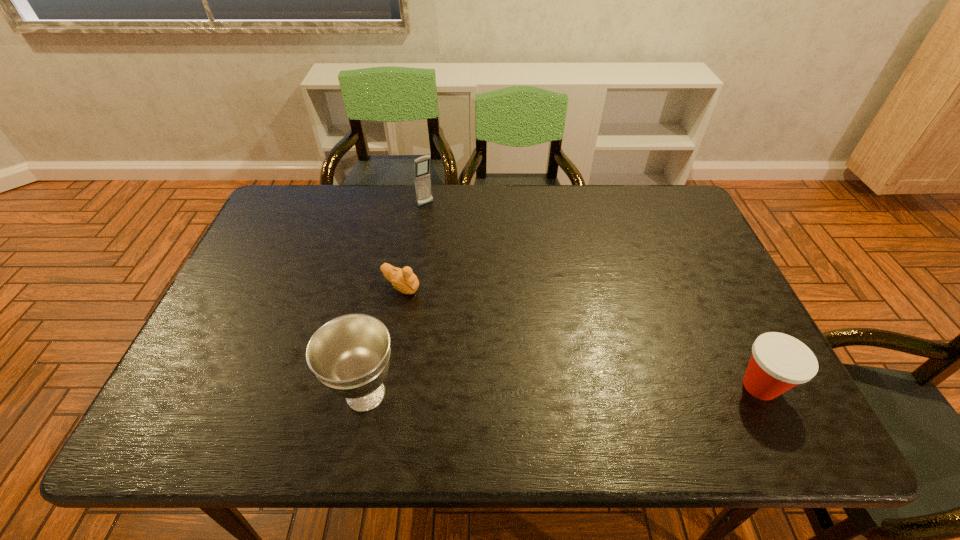
This screenshot has width=960, height=540. In order to click on free spot that satisfies the following two spatial constraints: 1. on the back side of the farthest object; 2. on the left side of the chalice in this screenshot , I will do `click(403, 204)`.